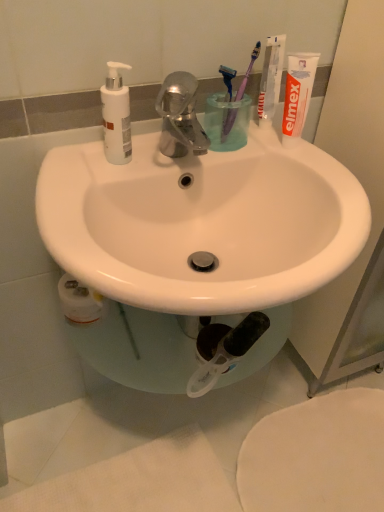
You are a GUI agent. You are given a task and a screenshot of the screen. Output one action in this format:
    pyautogui.click(x=<x>, y=<y>)
    Task: Click on the free space in front of purple plastic toothbrush at upper right, which is the 2th toothbrush from right to left
    This screenshot has height=512, width=384.
    Given the screenshot: What is the action you would take?
    pyautogui.click(x=219, y=156)